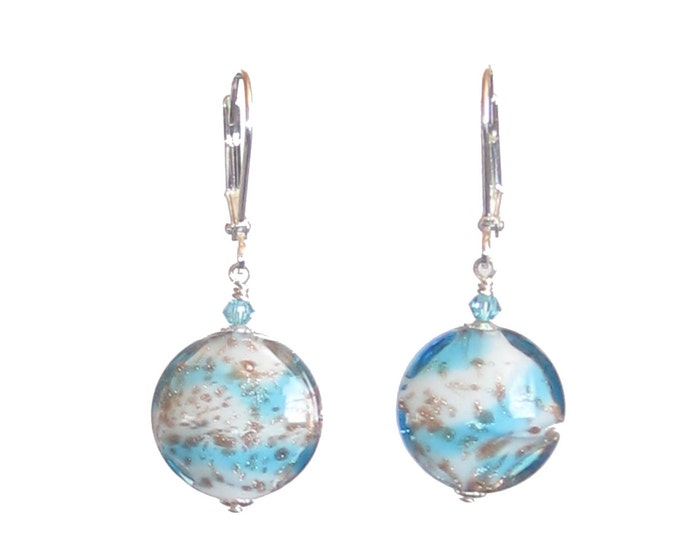
Where is `wall`? The width and height of the screenshot is (680, 540). wall is located at coordinates (362, 268).